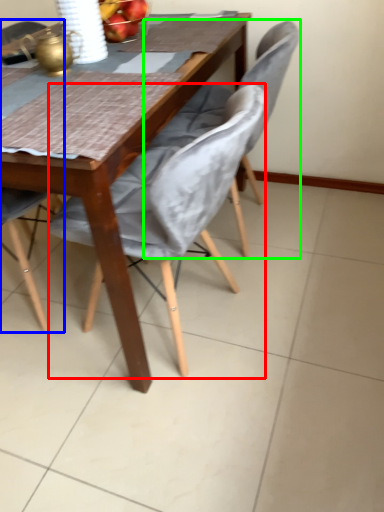
Question: Which object is positioned closest to chair (highlighted by a red box)? Select from chair (highlighted by a blue box) and chair (highlighted by a green box).

Choices:
 (A) chair
 (B) chair

Answer: (B)